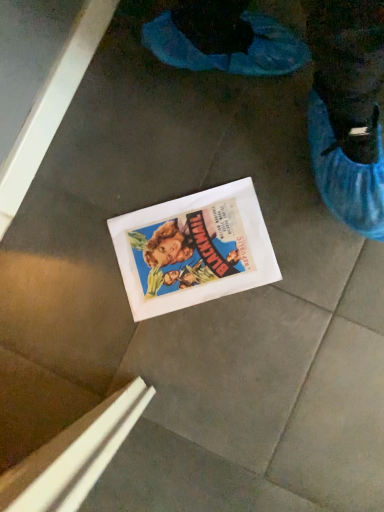
Question: Should I look upward or downward to see white paper comic book at center?

Choices:
 (A) up
 (B) down

Answer: (A)